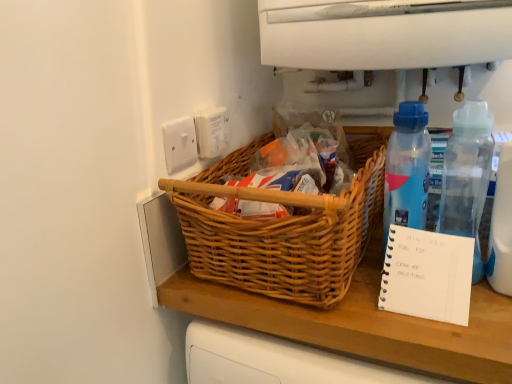
Question: Could you tell me if white plastic electric outlet at upper center, marked as the 1th electric outlet in a right-to-left arrangement, is turned towards blue translucent bottle at right, which is the second bottle from right to left?

Choices:
 (A) yes
 (B) no

Answer: (A)

Question: Would you consider white plastic electric outlet at upper center, the second electric outlet from the left, to be distant from blue translucent bottle at right, placed as the first bottle when sorted from left to right?

Choices:
 (A) yes
 (B) no

Answer: (B)

Question: Does white plastic electric outlet at upper center, marked as the 1th electric outlet in a right-to-left arrangement, have a greater height compared to blue translucent bottle at right, which is the second bottle from right to left?

Choices:
 (A) yes
 (B) no

Answer: (B)

Question: Considering the relative sizes of white plastic electric outlet at upper center, the second electric outlet from the left, and blue translucent bottle at right, placed as the first bottle when sorted from left to right, in the image provided, is white plastic electric outlet at upper center, the second electric outlet from the left, bigger than blue translucent bottle at right, placed as the first bottle when sorted from left to right,?

Choices:
 (A) no
 (B) yes

Answer: (A)

Question: Does white plastic electric outlet at upper center, the second electric outlet from the left, have a lesser width compared to blue translucent bottle at right, placed as the first bottle when sorted from left to right?

Choices:
 (A) no
 (B) yes

Answer: (B)

Question: Is woven wood picnic basket at center inside or outside of blue translucent bottle at right, placed as the first bottle when sorted from left to right?

Choices:
 (A) outside
 (B) inside

Answer: (A)

Question: From the image's perspective, is woven wood picnic basket at center above or below blue translucent bottle at right, which is the second bottle from right to left?

Choices:
 (A) below
 (B) above

Answer: (B)

Question: Considering the positions of woven wood picnic basket at center and blue translucent bottle at right, placed as the first bottle when sorted from left to right, in the image, is woven wood picnic basket at center wider or thinner than blue translucent bottle at right, placed as the first bottle when sorted from left to right,?

Choices:
 (A) wide
 (B) thin

Answer: (A)

Question: From their relative heights in the image, would you say woven wood picnic basket at center is taller or shorter than blue translucent bottle at right, which is the second bottle from right to left?

Choices:
 (A) tall
 (B) short

Answer: (B)

Question: Looking at their shapes, would you say blue translucent bottle at right, which is the second bottle from right to left, is wider or thinner than white plastic electric outlet at upper center, marked as the 1th electric outlet in a right-to-left arrangement?

Choices:
 (A) wide
 (B) thin

Answer: (A)

Question: Considering the relative positions of blue translucent bottle at right, placed as the first bottle when sorted from left to right, and white plastic electric outlet at upper center, marked as the 1th electric outlet in a right-to-left arrangement, in the image provided, is blue translucent bottle at right, placed as the first bottle when sorted from left to right, to the left or to the right of white plastic electric outlet at upper center, marked as the 1th electric outlet in a right-to-left arrangement,?

Choices:
 (A) left
 (B) right

Answer: (B)

Question: From the image's perspective, relative to white plastic electric outlet at upper center, marked as the 1th electric outlet in a right-to-left arrangement, is blue translucent bottle at right, which is the second bottle from right to left, above or below?

Choices:
 (A) above
 (B) below

Answer: (B)

Question: Is blue translucent bottle at right, placed as the first bottle when sorted from left to right, inside or outside of white plastic electric outlet at upper center, marked as the 1th electric outlet in a right-to-left arrangement?

Choices:
 (A) outside
 (B) inside

Answer: (A)

Question: In the image, is woven wood picnic basket at center positioned in front of or behind white plastic electric outlet at upper center, marked as the 1th electric outlet in a right-to-left arrangement?

Choices:
 (A) front
 (B) behind

Answer: (A)

Question: Is point click(246, 288) closer or farther from the camera than point click(194, 114)?

Choices:
 (A) closer
 (B) farther

Answer: (A)